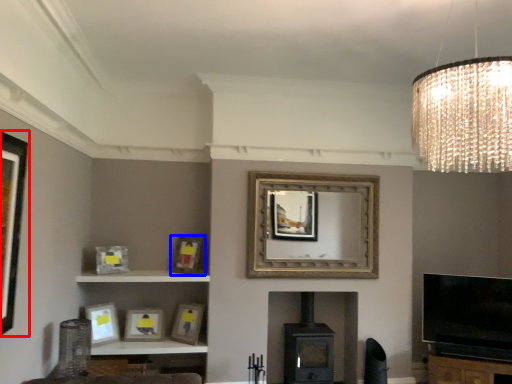
Question: Among these objects, which one is nearest to the camera, picture frame (highlighted by a red box) or picture frame (highlighted by a blue box)?

Choices:
 (A) picture frame
 (B) picture frame

Answer: (A)